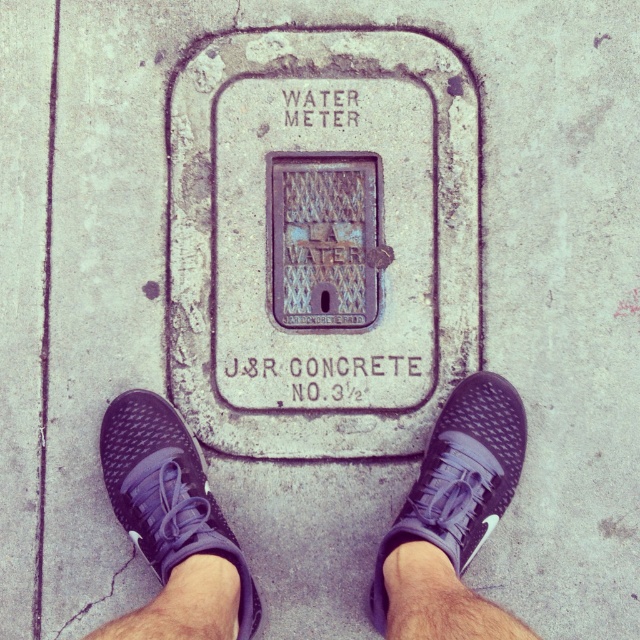
In the scene shown: You are standing on the sidewalk looking at the concrete water meter cover. There are two points marked on the cover at coordinates point (x=112, y=410) and point (x=372, y=624). Which point is closer to you?

Point (x=112, y=410) is in front of point (x=372, y=624), so it is closer to you.

You are standing on the sidewalk and see the black mesh sneakers at center. If you walk straight ahead, will you step on the concrete water meter cover?

The black mesh sneakers at center are located at point (452, 518), which is not overlapping with the concrete water meter cover, so walking straight ahead would not step on it.